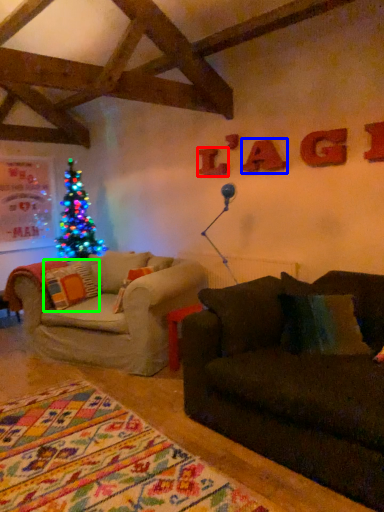
Question: Estimate the real-world distances between objects in this image. Which object is closer to letter (highlighted by a red box), letter (highlighted by a blue box) or pillow (highlighted by a green box)?

Choices:
 (A) letter
 (B) pillow

Answer: (A)